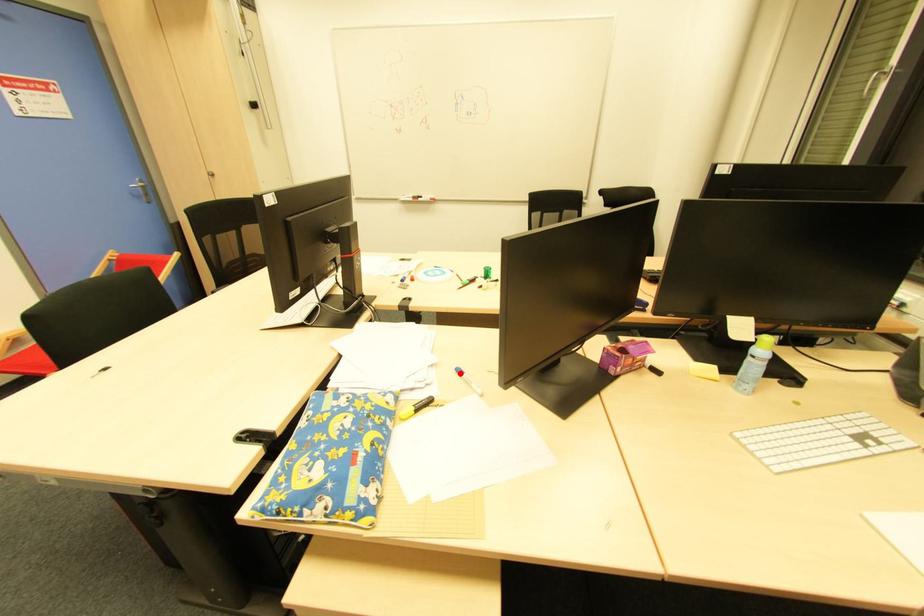
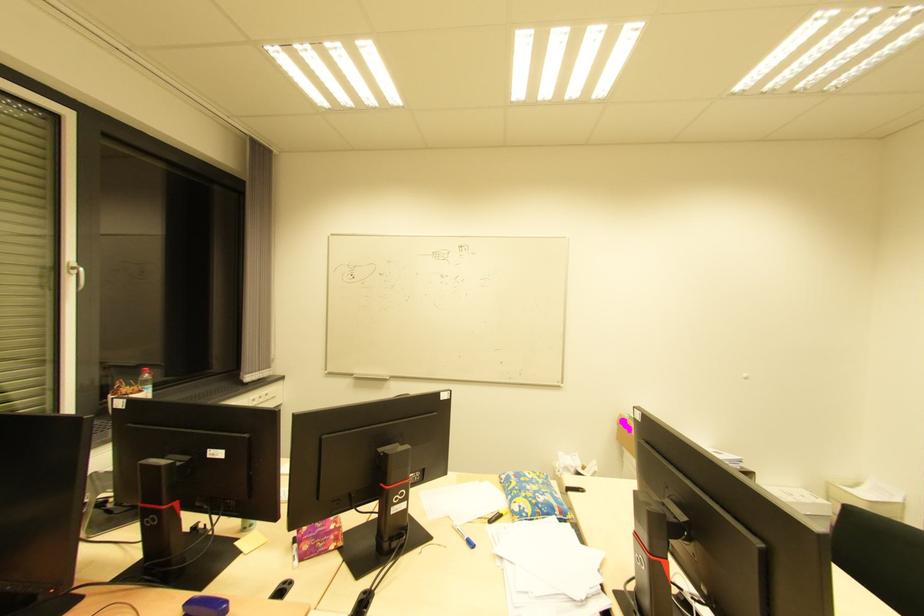
Where in the second image is the point corresponding to the highlighted location from the first image?

(470, 546)